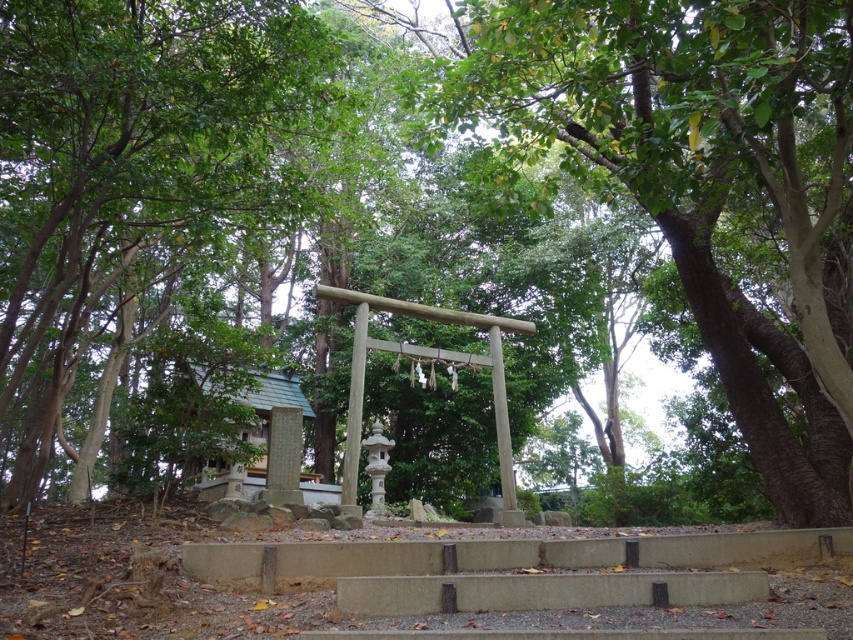
Between green leafy tree at center and green leafy tree at left, which one appears on the left side from the viewer's perspective?

From the viewer's perspective, green leafy tree at left appears more on the left side.

Is point (582, 42) closer to viewer compared to point (132, 141)?

Yes, it is.

Is point (664, 83) positioned before point (3, 134)?

Yes, point (664, 83) is closer to viewer.

Where is `green leafy tree at center`? The height and width of the screenshot is (640, 853). green leafy tree at center is located at coordinates (699, 176).